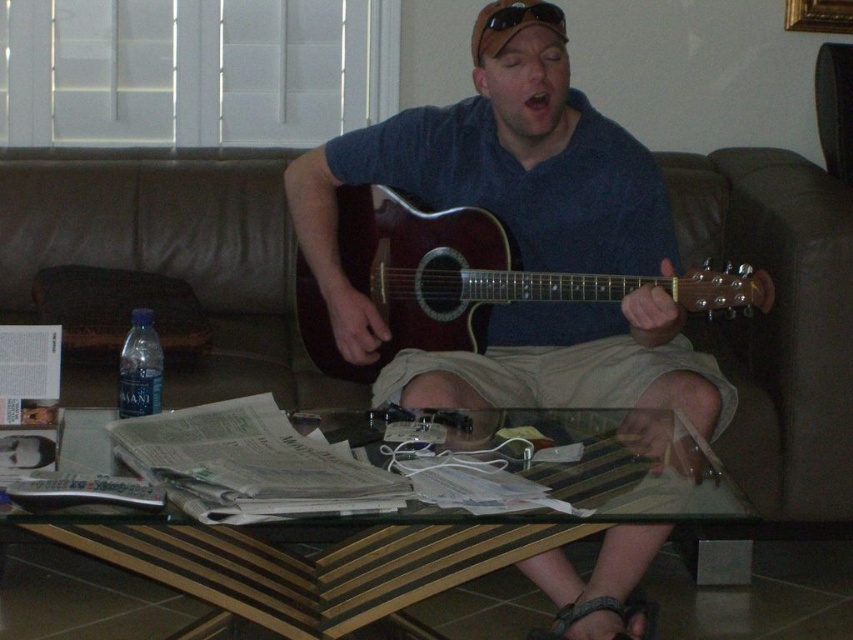
You are a delivery person standing at the entrance of the room. You need to place a package on the brown leather couch at center. Is the distance between you and the couch sufficient to walk directly to it without needing to navigate around any furniture?

The distance between you and the brown leather couch at center is 7.16 feet, which is sufficient to walk directly to it without needing to navigate around any furniture.

You are a guest in the living room and want to sit down on the leather at lower center. Is the brown leather couch at center blocking your path to it?

The leather at lower center is behind the brown leather couch at center, so the couch is blocking your path to it.